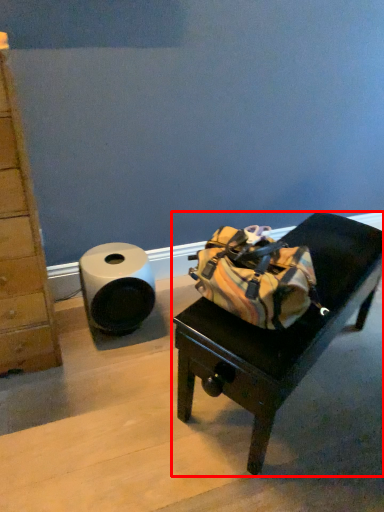
Question: From the image's perspective, where is furniture (annotated by the red box) located in relation to toilet paper in the image?

Choices:
 (A) above
 (B) below

Answer: (B)